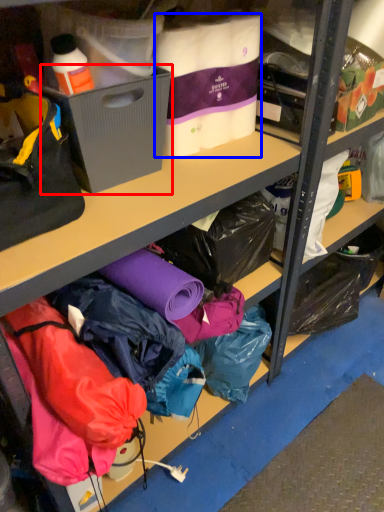
Question: Among these objects, which one is farthest to the camera, box (highlighted by a red box) or clothing (highlighted by a blue box)?

Choices:
 (A) box
 (B) clothing

Answer: (B)